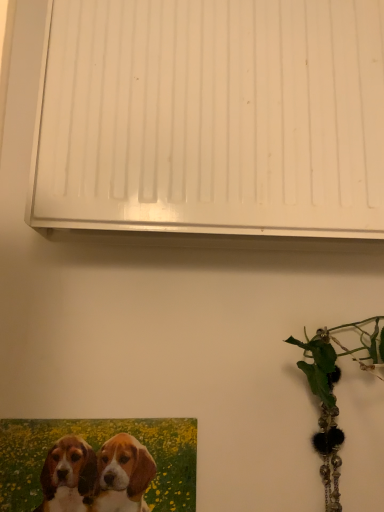
Describe the element at coordinates (96, 451) in the screenshot. I see `green matte painting at lower left` at that location.

This screenshot has width=384, height=512. In order to click on green matte painting at lower left in this screenshot , I will do `click(96, 451)`.

In order to face green matte painting at lower left, should I rotate leftwards or rightwards?

Rotate your view left by about 12.387°.

At what (x,y) coordinates should I click in order to perform the action: click on green matte painting at lower left. Please return your answer as a coordinate pair (x, y). The width and height of the screenshot is (384, 512). Looking at the image, I should click on (96, 451).